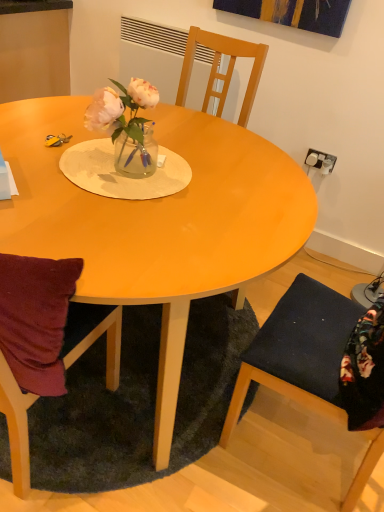
In order to click on free space to the back side of translucent glass vase at center in this screenshot , I will do `click(155, 146)`.